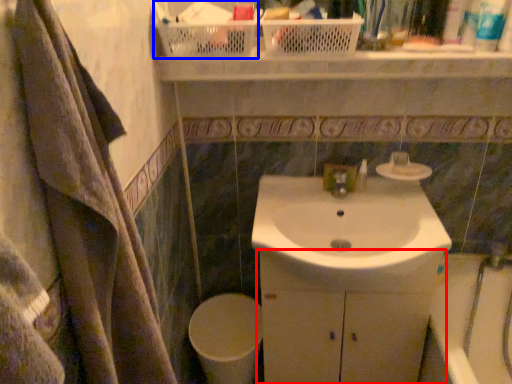
Question: Which point is further to the camera, bathroom cabinet (highlighted by a red box) or basket (highlighted by a blue box)?

Choices:
 (A) bathroom cabinet
 (B) basket

Answer: (A)